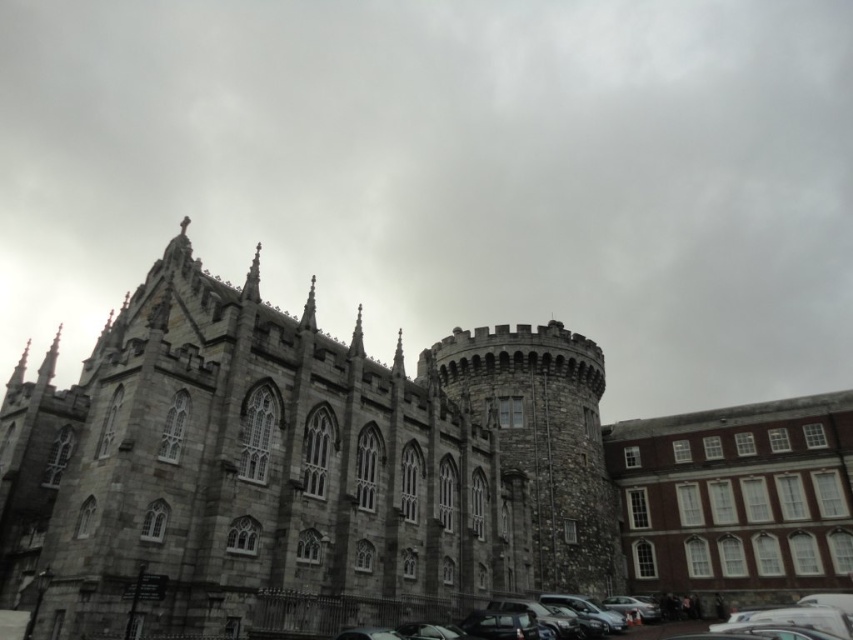
Does gray stone castle at center appear on the right side of shiny black car at lower center?

No, gray stone castle at center is not to the right of shiny black car at lower center.

Does gray stone castle at center have a greater height compared to shiny black car at lower center?

Yes.

Which is in front, point (109, 538) or point (828, 596)?

Point (109, 538) is more forward.

Identify the location of gray stone castle at center. (294, 465).